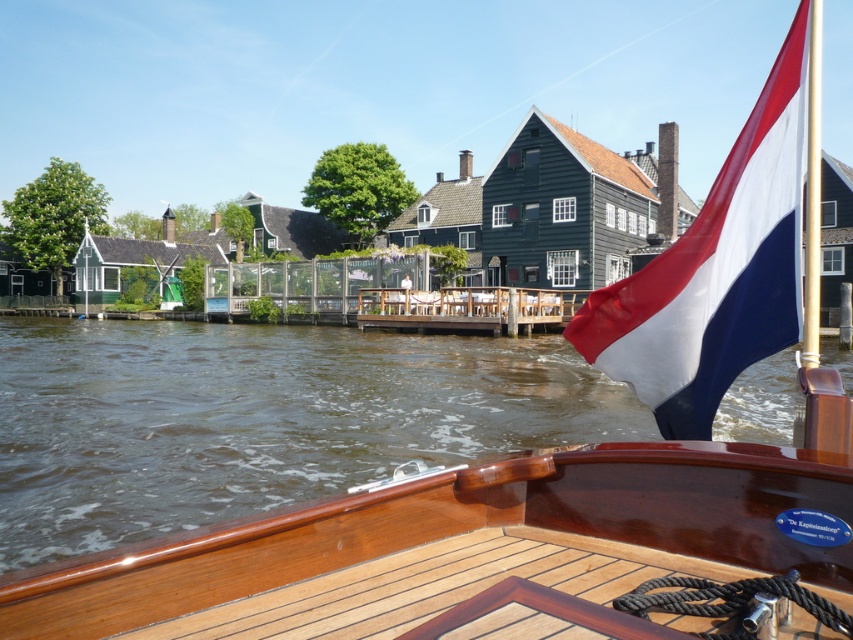
Question: Is brown water at center thinner than polished wood flagpole at upper right?

Choices:
 (A) yes
 (B) no

Answer: (B)

Question: Observing the image, what is the correct spatial positioning of brown water at center in reference to polished wood flagpole at upper right?

Choices:
 (A) above
 (B) below

Answer: (B)

Question: Which object appears farthest from the camera in this image?

Choices:
 (A) brown water at center
 (B) polished wood flagpole at upper right
 (C) tri-color fabric flag at upper right

Answer: (A)

Question: In this image, where is brown water at center located relative to tri-color fabric flag at upper right?

Choices:
 (A) above
 (B) below

Answer: (B)

Question: Which of the following is the farthest from the observer?

Choices:
 (A) (612, 362)
 (B) (318, 458)
 (C) (805, 300)

Answer: (B)

Question: Among these points, which one is nearest to the camera?

Choices:
 (A) (343, 417)
 (B) (819, 189)
 (C) (677, 390)

Answer: (B)